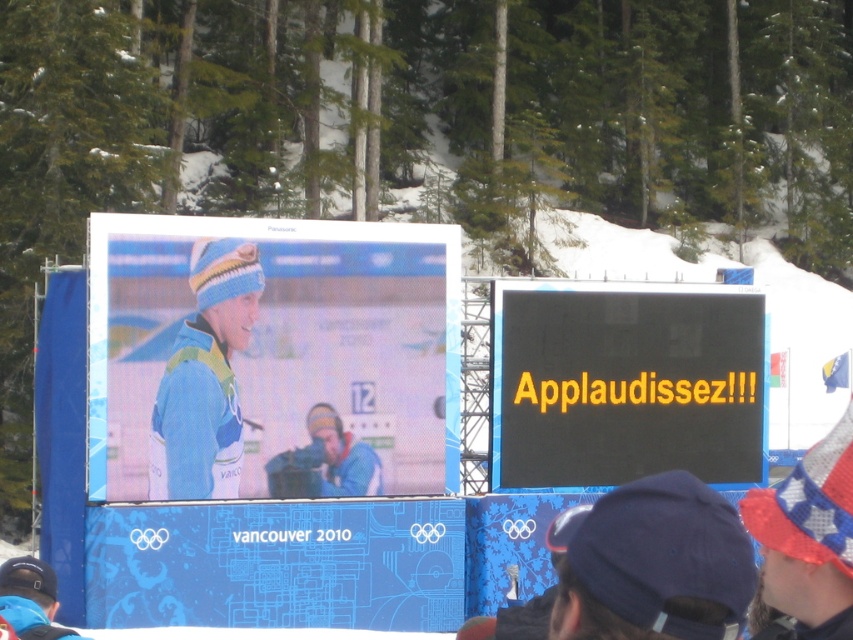
Is black matte sign at center shorter than blue knit hat at lower left?

Correct, black matte sign at center is not as tall as blue knit hat at lower left.

Is black matte sign at center behind blue knit hat at lower left?

That is True.

Locate an element on the screen. This screenshot has height=640, width=853. black matte sign at center is located at coordinates (624, 385).

Is point (200, 490) farther from camera compared to point (849, 468)?

Yes, point (200, 490) is farther from viewer.

The height and width of the screenshot is (640, 853). What are the coordinates of `matte blue ski suit at center` in the screenshot? It's located at [x=206, y=378].

Which is below, blue fabric screen at center or blue knit hat at lower left?

blue knit hat at lower left is below.

Is blue fabric screen at center above blue knit hat at lower left?

Yes.

In order to click on blue fabric screen at center in this screenshot , I will do `click(271, 355)`.